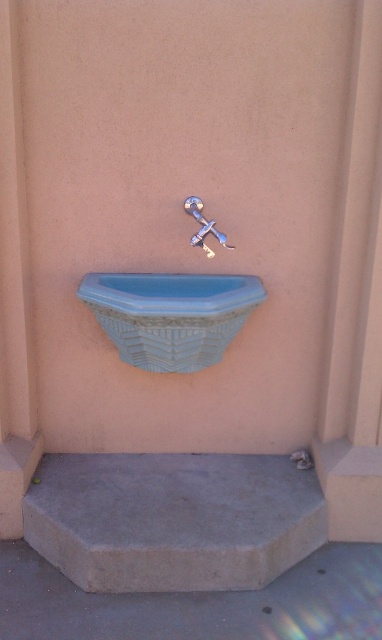
Can you confirm if blue ceramic sink at center is positioned below satin nickel faucet at center?

Yes.

Who is shorter, blue ceramic sink at center or satin nickel faucet at center?

satin nickel faucet at center

The image size is (382, 640). I want to click on blue ceramic sink at center, so click(171, 316).

Between point (171, 538) and point (223, 236), which one is positioned behind?

The point (223, 236) is more distant.

Does gray concrete step at lower center have a lesser width compared to satin nickel faucet at center?

No.

This screenshot has width=382, height=640. What do you see at coordinates (173, 518) in the screenshot? I see `gray concrete step at lower center` at bounding box center [173, 518].

You are a GUI agent. You are given a task and a screenshot of the screen. Output one action in this format:
    pyautogui.click(x=<x>, y=<y>)
    Task: Click on the gray concrete step at lower center
    
    Given the screenshot: What is the action you would take?
    pyautogui.click(x=173, y=518)

The height and width of the screenshot is (640, 382). I want to click on gray concrete step at lower center, so click(x=173, y=518).

Is gray concrete step at lower center to the left of blue ceramic sink at center from the viewer's perspective?

In fact, gray concrete step at lower center is to the right of blue ceramic sink at center.

Is point (187, 488) closer to viewer compared to point (105, 332)?

No, (187, 488) is further to viewer.

Identify the location of gray concrete step at lower center. The height and width of the screenshot is (640, 382). (173, 518).